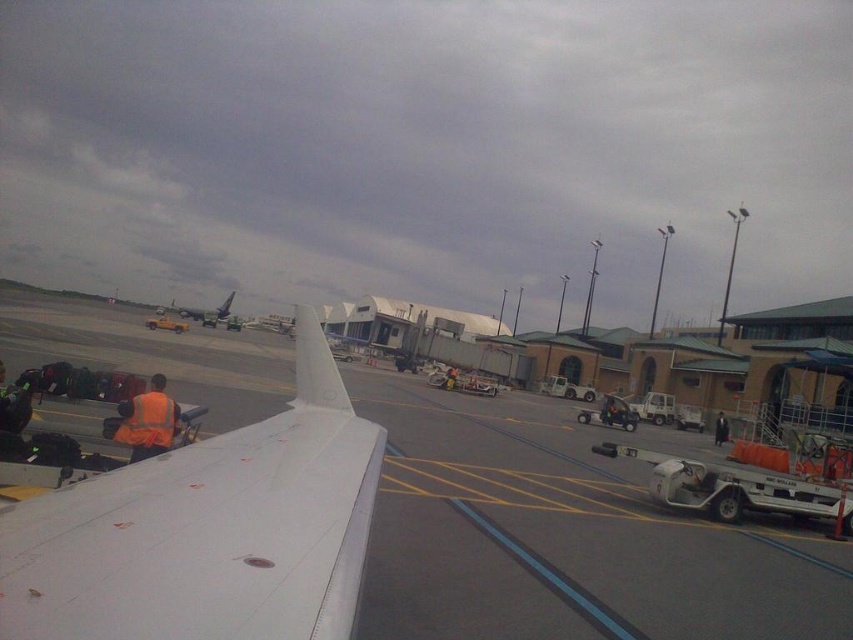
Who is higher up, metallic gray airplane at center or orange reflective vest at center?

metallic gray airplane at center

Can you confirm if metallic gray airplane at center is smaller than orange reflective vest at center?

No, metallic gray airplane at center is not smaller than orange reflective vest at center.

This screenshot has width=853, height=640. What do you see at coordinates (207, 312) in the screenshot? I see `metallic gray airplane at center` at bounding box center [207, 312].

Find the location of a particular element. Image resolution: width=853 pixels, height=640 pixels. metallic gray airplane at center is located at coordinates (207, 312).

Is point (572, 611) positioned behind point (723, 413)?

No, (572, 611) is in front of (723, 413).

Who is positioned more to the left, white matte tarmac at center or orange reflective vest at center?

From the viewer's perspective, white matte tarmac at center appears more on the left side.

Between point (556, 404) and point (714, 440), which one is positioned in front?

Point (714, 440) is more forward.

Identify the location of white matte tarmac at center. (566, 532).

Measure the distance between white matte wing at lower left and yellow matte truck at center.

60.63 meters

From the picture: Which is more to the right, white matte wing at lower left or yellow matte truck at center?

Positioned to the right is white matte wing at lower left.

Is point (32, 580) in front of point (163, 320)?

Yes.

Identify the location of white matte wing at lower left. This screenshot has width=853, height=640. (207, 529).